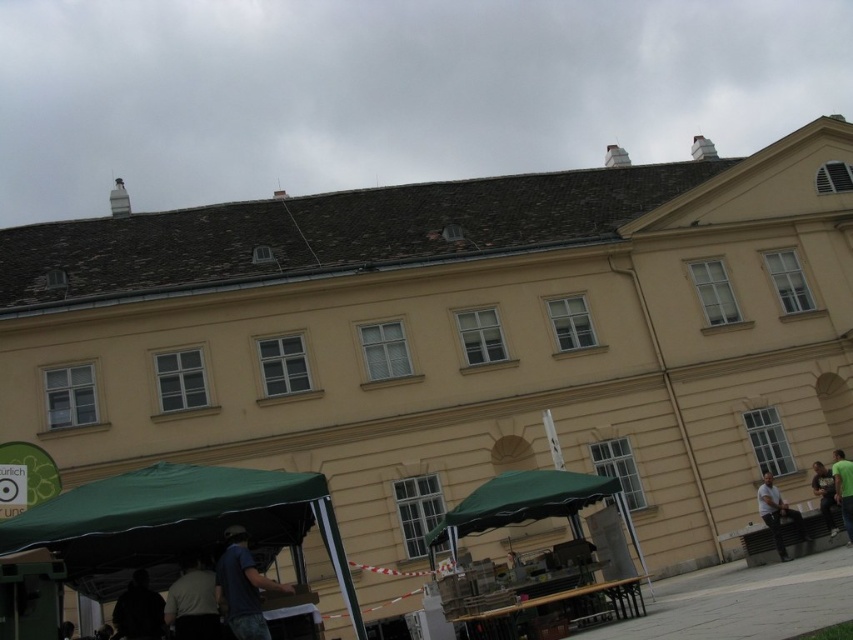
Does point (198, 584) lie behind point (845, 467)?

That is False.

What are the coordinates of `dark gray shirt at lower center` in the screenshot? It's located at (192, 602).

Is green fabric canopy at lower left shorter than green fabric canopy at center?

No, green fabric canopy at lower left is not shorter than green fabric canopy at center.

This screenshot has width=853, height=640. In order to click on green fabric canopy at lower left in this screenshot , I will do `click(180, 518)`.

Where is `green fabric canopy at lower left`? Image resolution: width=853 pixels, height=640 pixels. green fabric canopy at lower left is located at coordinates (180, 518).

Does dark blue shirt at center have a greater width compared to green fabric umbrella at lower right?

No.

Is dark blue shirt at center positioned behind green fabric umbrella at lower right?

No, it is in front of green fabric umbrella at lower right.

Who is more distant from viewer, (228, 556) or (844, 484)?

Positioned behind is point (844, 484).

Where is `dark blue shirt at center`? This screenshot has height=640, width=853. dark blue shirt at center is located at coordinates (242, 588).